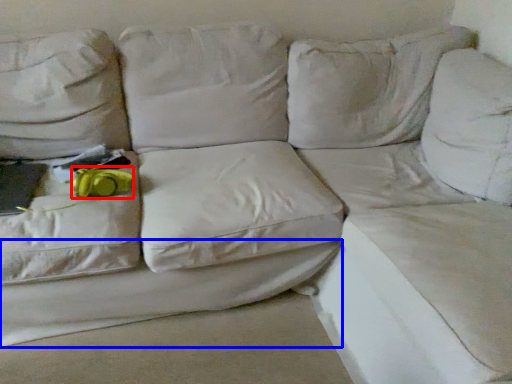
Question: Which object is closer to the camera taking this photo, stuff (highlighted by a red box) or sheet (highlighted by a blue box)?

Choices:
 (A) stuff
 (B) sheet

Answer: (B)